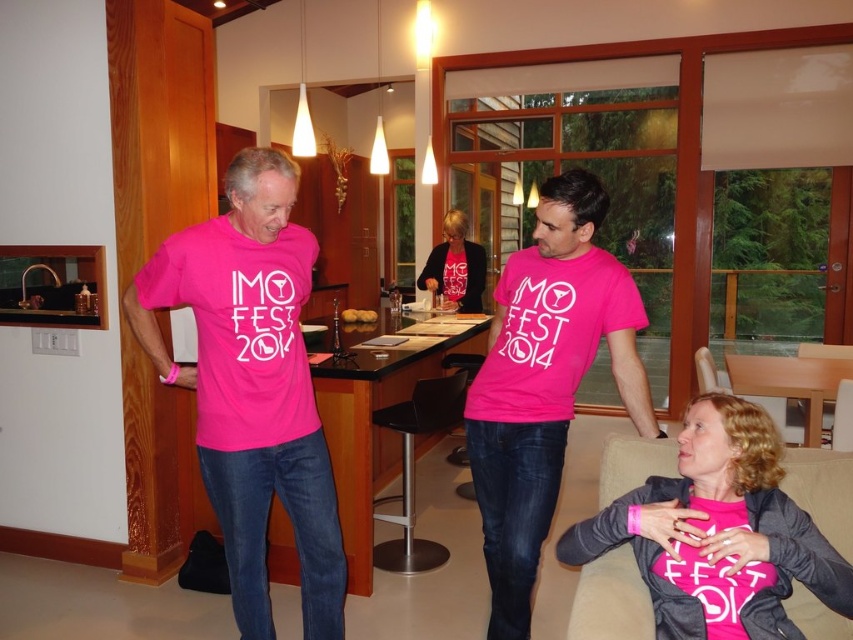
Question: Can you confirm if pink matte t-shirt at center is positioned to the right of pink matte shirt at center?

Choices:
 (A) no
 (B) yes

Answer: (A)

Question: Among these points, which one is farthest from the camera?

Choices:
 (A) (706, 442)
 (B) (126, 312)

Answer: (B)

Question: Does pink matte shirt at center have a larger size compared to pink jersey at center?

Choices:
 (A) yes
 (B) no

Answer: (B)

Question: Which object is closer to the camera taking this photo?

Choices:
 (A) pink matte t-shirt at left
 (B) pink matte shirt at center

Answer: (B)

Question: Observing the image, what is the correct spatial positioning of pink matte t-shirt at center in reference to pink jersey at center?

Choices:
 (A) right
 (B) left

Answer: (A)

Question: Which point appears farthest from the camera in this image?

Choices:
 (A) (309, 564)
 (B) (448, 280)
 (C) (643, 550)
 (D) (527, 636)

Answer: (B)